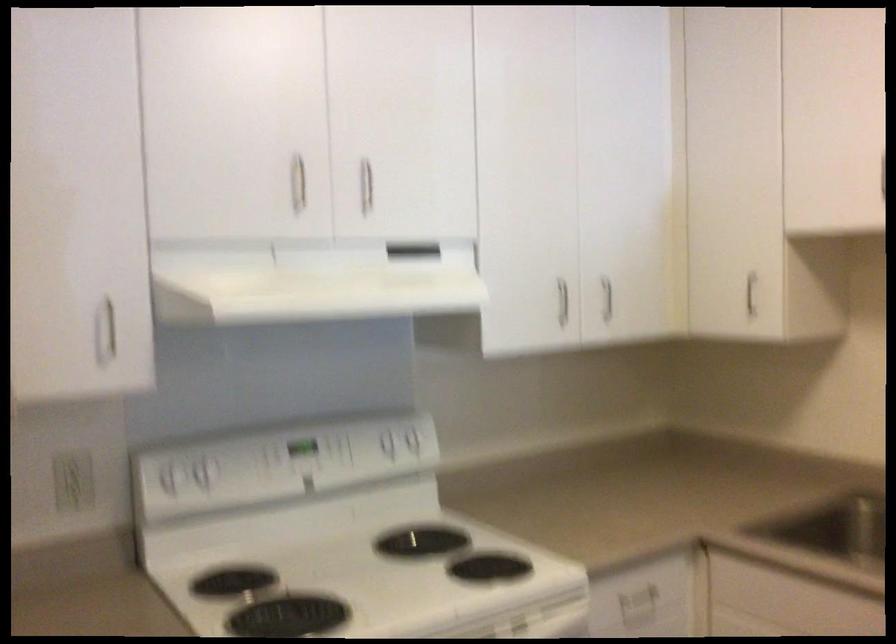
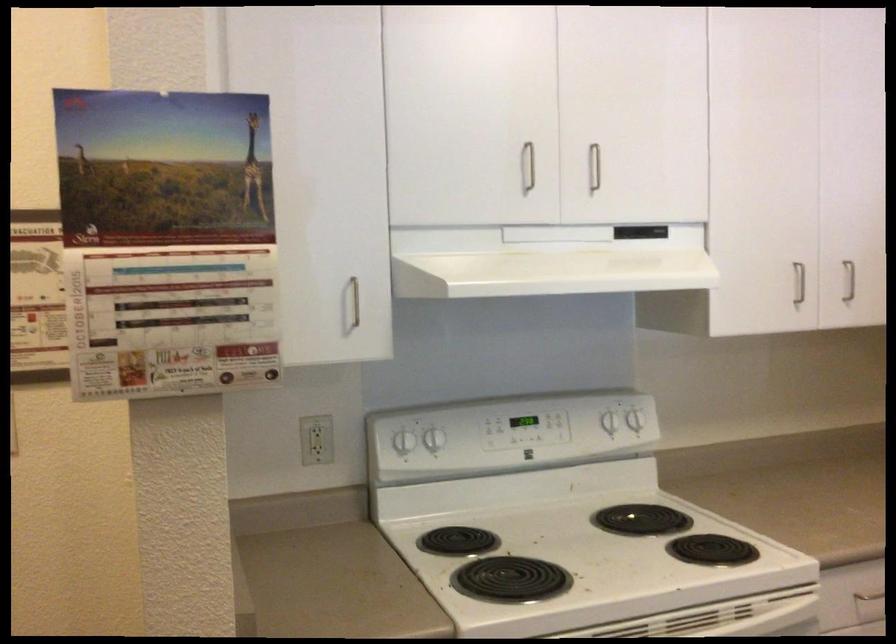
Find the pixel in the second image that matches [561,301] in the first image.

(798, 283)